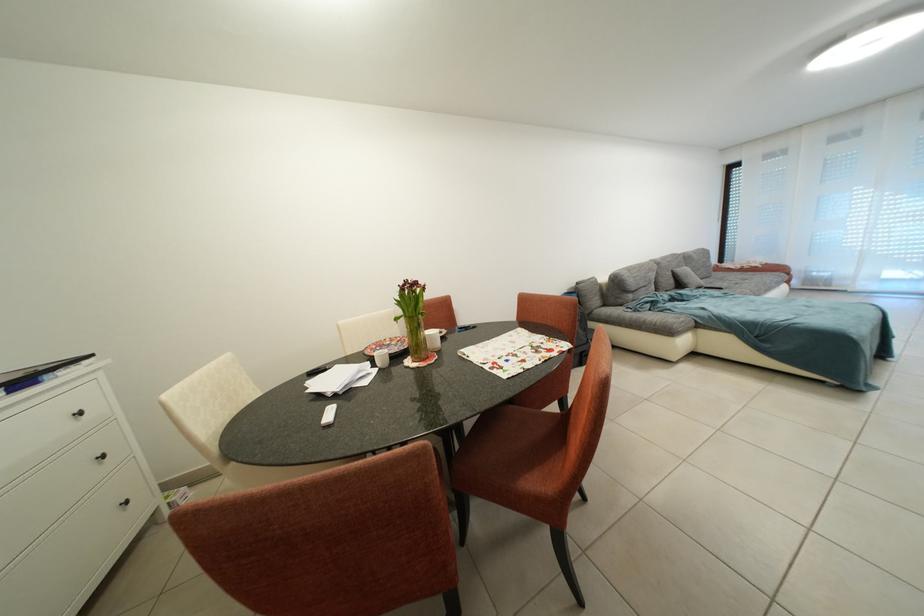
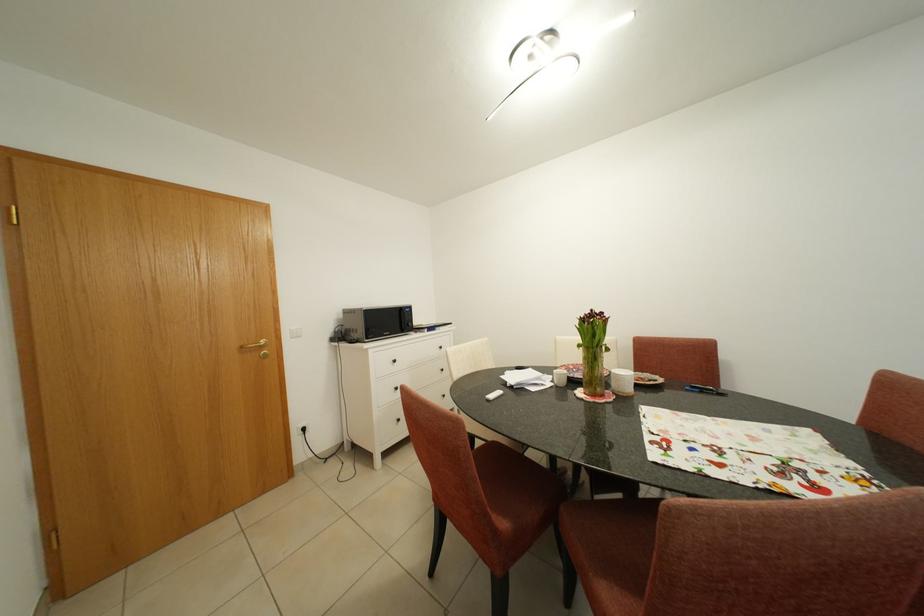
Find the pixel in the second image that matches (x=405, y=323) in the first image.

(588, 350)